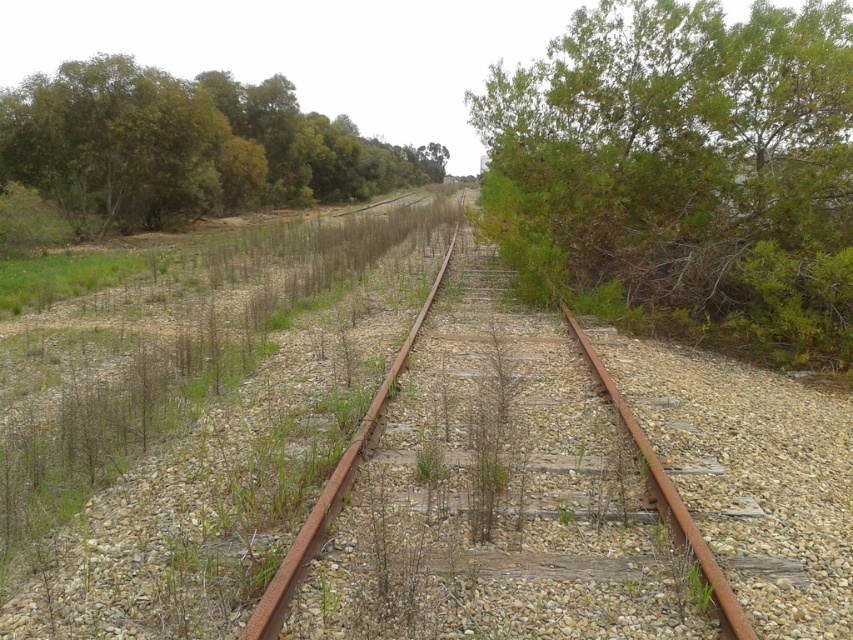
Does green leafy bush at right have a greater height compared to rusty metal track at center?

Indeed, green leafy bush at right has a greater height compared to rusty metal track at center.

Between point (711, 68) and point (521, 612), which one is positioned behind?

Positioned behind is point (711, 68).

Which is behind, point (680, 189) or point (608, 461)?

Positioned behind is point (680, 189).

Where is `green leafy bush at right`? Image resolution: width=853 pixels, height=640 pixels. green leafy bush at right is located at coordinates (683, 173).

How distant is green leafy bush at right from green leafy tree at upper left?

The distance of green leafy bush at right from green leafy tree at upper left is 22.33 meters.

Can you confirm if green leafy bush at right is shorter than green leafy tree at upper left?

Indeed, green leafy bush at right has a lesser height compared to green leafy tree at upper left.

You are a GUI agent. You are given a task and a screenshot of the screen. Output one action in this format:
    pyautogui.click(x=<x>, y=<y>)
    Task: Click on the green leafy bush at right
    The width and height of the screenshot is (853, 640).
    Given the screenshot: What is the action you would take?
    pyautogui.click(x=683, y=173)

Can you confirm if rusty metal track at center is positioned to the right of green leafy tree at upper left?

Correct, you'll find rusty metal track at center to the right of green leafy tree at upper left.

Can you confirm if rusty metal track at center is shorter than green leafy tree at upper left?

Correct, rusty metal track at center is not as tall as green leafy tree at upper left.

Is point (521, 621) closer to camera compared to point (352, 189)?

Yes.

Identify the location of rusty metal track at center. Image resolution: width=853 pixels, height=640 pixels. point(495,496).